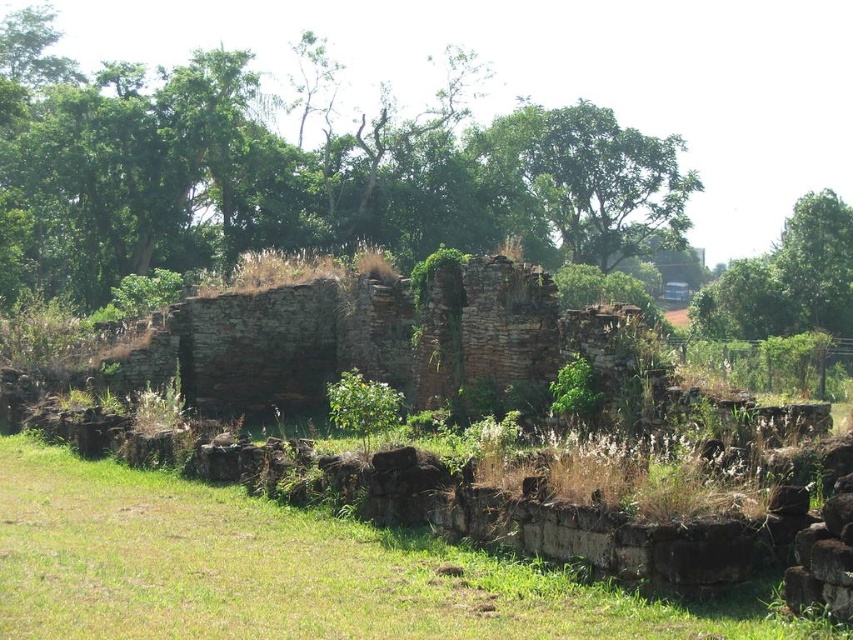
You are standing at the origin point of the coordinate system. You want to walk to the green leafy tree at center. Which direction should you walk?

You should walk towards the point with coordinates of 0.272 on the x axis and 0.348 on the y axis to reach the green leafy tree at center.

You are standing in front of the ancient stone structure and want to find a clear path to the green leafy tree at upper center. Is the green grass at lower center a good path to take towards the tree?

Yes, the green grass at lower center is a good path to take towards the green leafy tree at upper center because it is located below the tree, indicating it leads directly underneath it.